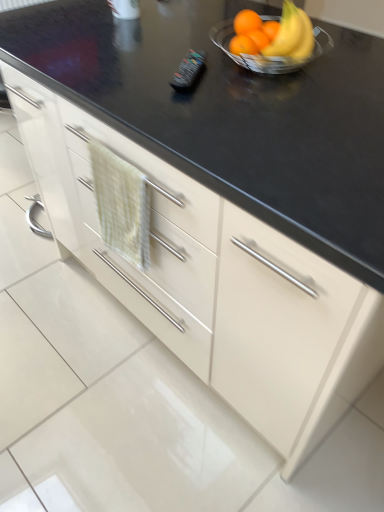
Question: Looking at their shapes, would you say black plastic remote control at center is wider or thinner than green textured hand towel at center-left?

Choices:
 (A) thin
 (B) wide

Answer: (A)

Question: Do you think black plastic remote control at center is within green textured hand towel at center-left, or outside of it?

Choices:
 (A) outside
 (B) inside

Answer: (A)

Question: Which object is positioned closest to the shiny metallic bowl at upper right?

Choices:
 (A) clear glass bowl at upper right
 (B) green textured hand towel at center-left
 (C) orange matte at upper right
 (D) black plastic remote control at center

Answer: (C)

Question: Based on their relative distances, which object is nearer to the orange matte at upper right?

Choices:
 (A) shiny metallic bowl at upper right
 (B) clear glass bowl at upper right
 (C) green textured hand towel at center-left
 (D) black plastic remote control at center

Answer: (A)